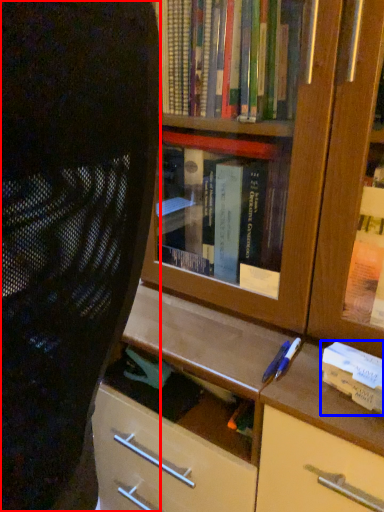
Question: Which object is further to the camera taking this photo, person (highlighted by a red box) or paperback book (highlighted by a blue box)?

Choices:
 (A) person
 (B) paperback book

Answer: (B)